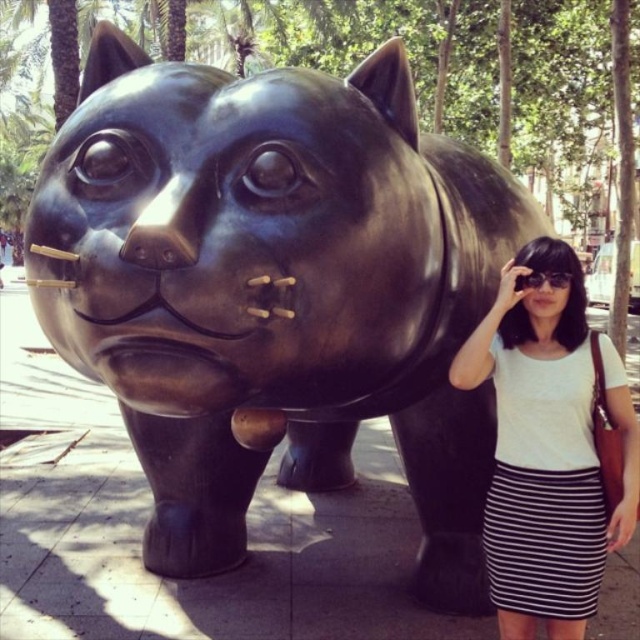
Question: Where is white striped skirt at lower right located in relation to black plastic goggles at upper center in the image?

Choices:
 (A) right
 (B) left

Answer: (A)

Question: Is white striped skirt at lower right to the left of black plastic goggles at upper center from the viewer's perspective?

Choices:
 (A) yes
 (B) no

Answer: (B)

Question: Which of the following is the closest to the observer?

Choices:
 (A) black plastic goggles at upper center
 (B) white striped skirt at lower right

Answer: (B)

Question: Which object appears farthest from the camera in this image?

Choices:
 (A) black plastic goggles at upper center
 (B) white striped skirt at lower right

Answer: (A)

Question: Which point is farther from the camera taking this photo?

Choices:
 (A) (531, 282)
 (B) (483, 333)

Answer: (B)

Question: Can you confirm if white striped skirt at lower right is positioned to the right of black plastic goggles at upper center?

Choices:
 (A) no
 (B) yes

Answer: (B)